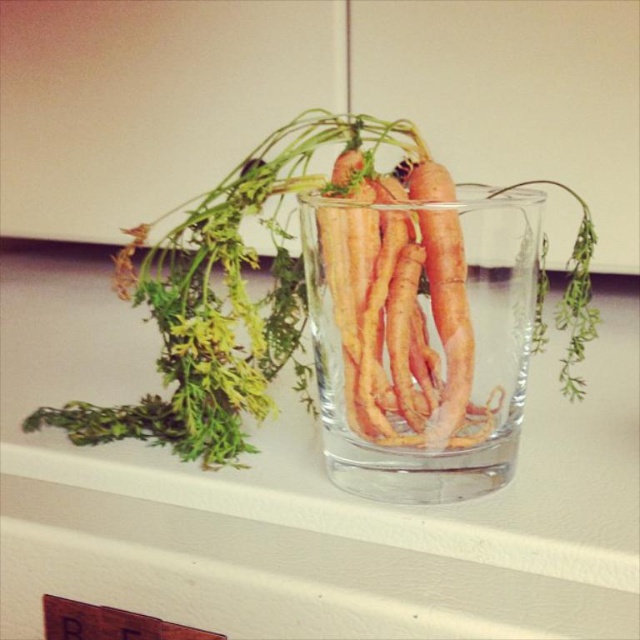
Question: Considering the relative positions of clear glass at center and translucent glass vase at center in the image provided, where is clear glass at center located with respect to translucent glass vase at center?

Choices:
 (A) above
 (B) below

Answer: (B)

Question: Which of the following is the closest to the observer?

Choices:
 (A) transparent glass carrots at center
 (B) orange rough skin carrots at center
 (C) translucent glass vase at center
 (D) clear glass at center

Answer: (D)

Question: Among these objects, which one is farthest from the camera?

Choices:
 (A) transparent glass carrots at center
 (B) orange rough skin carrots at center
 (C) translucent glass vase at center
 (D) clear glass at center

Answer: (B)

Question: Estimate the real-world distances between objects in this image. Which object is closer to the clear glass at center?

Choices:
 (A) transparent glass carrots at center
 (B) translucent glass vase at center

Answer: (B)

Question: Observing the image, what is the correct spatial positioning of clear glass at center in reference to transparent glass carrots at center?

Choices:
 (A) above
 (B) below

Answer: (A)

Question: Can you confirm if translucent glass vase at center is bigger than orange rough skin carrots at center?

Choices:
 (A) no
 (B) yes

Answer: (B)